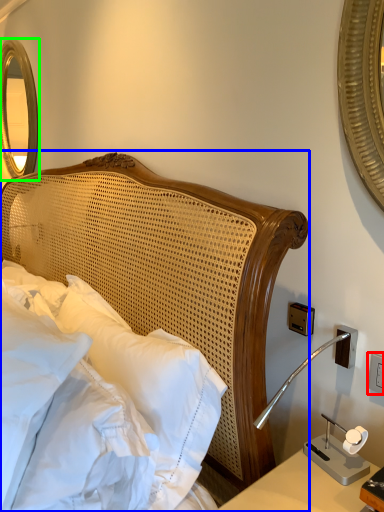
Question: Based on their relative distances, which object is farther from electric outlet (highlighted by a red box)? Choose from bed (highlighted by a blue box) and mirror (highlighted by a green box).

Choices:
 (A) bed
 (B) mirror

Answer: (B)